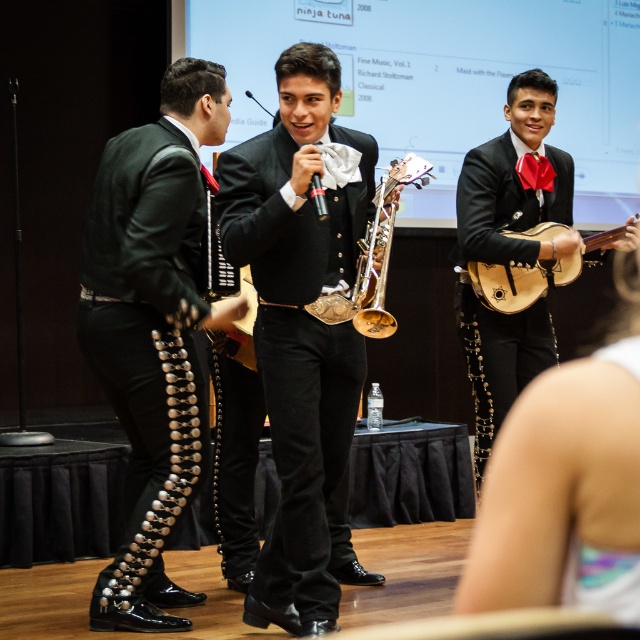
Question: Which point is closer to the camera?

Choices:
 (A) shiny black suit at center
 (B) gold brass trumpet at center
 (C) green shiny vest at left
 (D) wooden mandolin at right

Answer: (A)

Question: Is shiny black suit at center closer to the viewer compared to green shiny vest at left?

Choices:
 (A) no
 (B) yes

Answer: (B)

Question: Which of the following is the closest to the observer?

Choices:
 (A) (372, 298)
 (B) (616, 232)
 (C) (339, 513)

Answer: (A)

Question: Does wooden mandolin at right have a smaller size compared to gold brass trumpet at center?

Choices:
 (A) yes
 (B) no

Answer: (A)

Question: Which point is closer to the camera?

Choices:
 (A) (156, 307)
 (B) (276, 525)
 (C) (545, 237)

Answer: (A)

Question: Can you confirm if wooden mandolin at right is wider than gold brass trumpet at center?

Choices:
 (A) no
 (B) yes

Answer: (B)